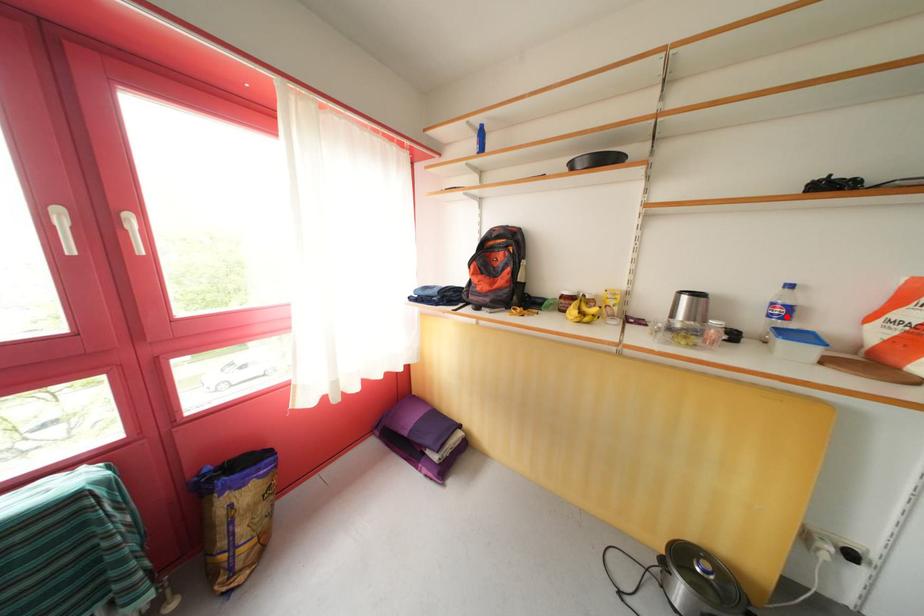
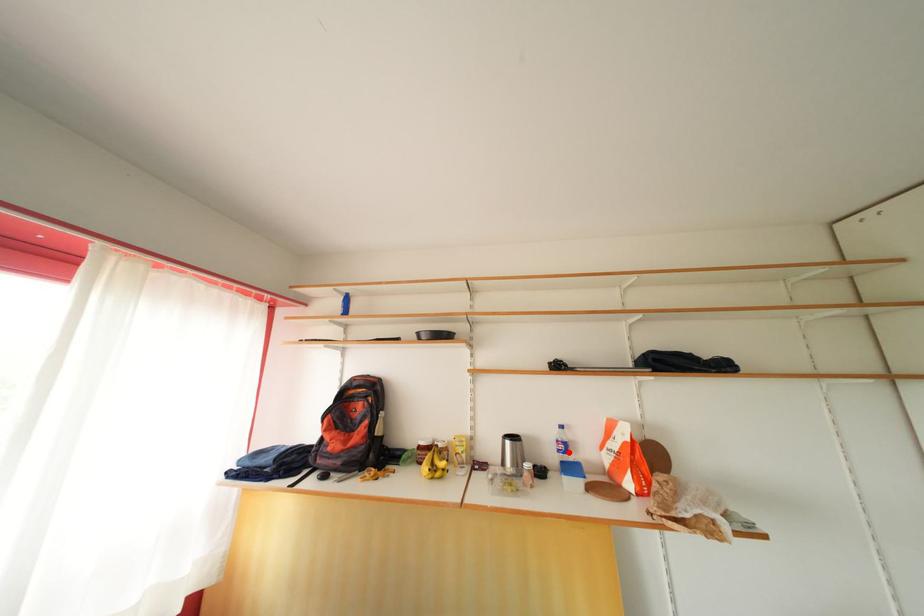
I am providing you with two images of the same scene from different viewpoints. A red point is marked on the first image and another point is marked on the second image. Is the marked point in image1 the same physical position as the marked point in image2?

Yes